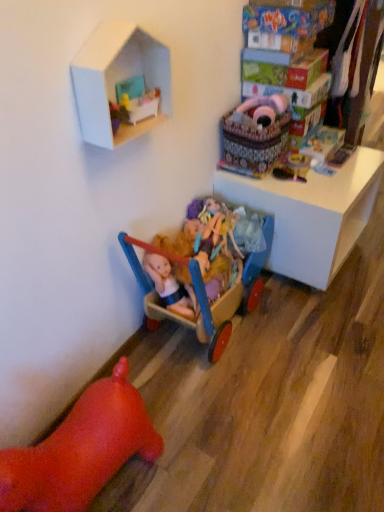
Question: Is velvet pink baby carriage at upper right, which is counted as the 5th toy, starting from the left, completely or partially inside wooden toy car at upper right, the first toy when ordered from right to left?

Choices:
 (A) yes
 (B) no

Answer: (B)

Question: Is wooden toy car at upper right, which ranks as the seventh toy in left-to-right order, facing towards velvet pink baby carriage at upper right, which is counted as the 5th toy, starting from the left?

Choices:
 (A) yes
 (B) no

Answer: (B)

Question: From a real-world perspective, is wooden toy car at upper right, the first toy when ordered from right to left, beneath velvet pink baby carriage at upper right, the third toy positioned from the right?

Choices:
 (A) yes
 (B) no

Answer: (A)

Question: Is velvet pink baby carriage at upper right, the third toy positioned from the right, at the back of wooden toy car at upper right, which ranks as the seventh toy in left-to-right order?

Choices:
 (A) yes
 (B) no

Answer: (B)

Question: Is wooden toy car at upper right, which ranks as the seventh toy in left-to-right order, taller than velvet pink baby carriage at upper right, which is counted as the 5th toy, starting from the left?

Choices:
 (A) yes
 (B) no

Answer: (B)

Question: Looking at their shapes, would you say white cardboard dollhouse at upper center is wider or thinner than wooden toy car at upper right, which ranks as the seventh toy in left-to-right order?

Choices:
 (A) wide
 (B) thin

Answer: (A)

Question: In the image, is white cardboard dollhouse at upper center positioned in front of or behind wooden toy car at upper right, which ranks as the seventh toy in left-to-right order?

Choices:
 (A) behind
 (B) front

Answer: (B)

Question: Looking at the image, does white cardboard dollhouse at upper center seem bigger or smaller compared to wooden toy car at upper right, the first toy when ordered from right to left?

Choices:
 (A) small
 (B) big

Answer: (B)

Question: From a real-world perspective, relative to wooden toy car at upper right, which ranks as the seventh toy in left-to-right order, is white cardboard dollhouse at upper center vertically above or below?

Choices:
 (A) below
 (B) above

Answer: (B)

Question: From the image's perspective, is rubber pig at lower left, the seventh toy viewed from the right, above or below wooden doll carriage at upper center, acting as the 4th toy starting from the left?

Choices:
 (A) above
 (B) below

Answer: (B)

Question: In the image, is rubber pig at lower left, the 1th toy when ordered from left to right, positioned in front of or behind wooden doll carriage at upper center, acting as the 4th toy starting from the left?

Choices:
 (A) behind
 (B) front

Answer: (B)

Question: Considering the positions of rubber pig at lower left, the seventh toy viewed from the right, and wooden doll carriage at upper center, which is counted as the 4th toy, starting from the right, in the image, is rubber pig at lower left, the seventh toy viewed from the right, bigger or smaller than wooden doll carriage at upper center, which is counted as the 4th toy, starting from the right,?

Choices:
 (A) big
 (B) small

Answer: (A)

Question: Is rubber pig at lower left, the 1th toy when ordered from left to right, wider or thinner than wooden doll carriage at upper center, which is counted as the 4th toy, starting from the right?

Choices:
 (A) thin
 (B) wide

Answer: (B)

Question: Is wooden toy at center, the sixth toy viewed from the left, spatially inside velvet pink baby carriage at upper right, the third toy positioned from the right, or outside of it?

Choices:
 (A) outside
 (B) inside

Answer: (A)

Question: Looking at the image, does wooden toy at center, the 2th toy in the right-to-left sequence, seem bigger or smaller compared to velvet pink baby carriage at upper right, which is counted as the 5th toy, starting from the left?

Choices:
 (A) big
 (B) small

Answer: (B)